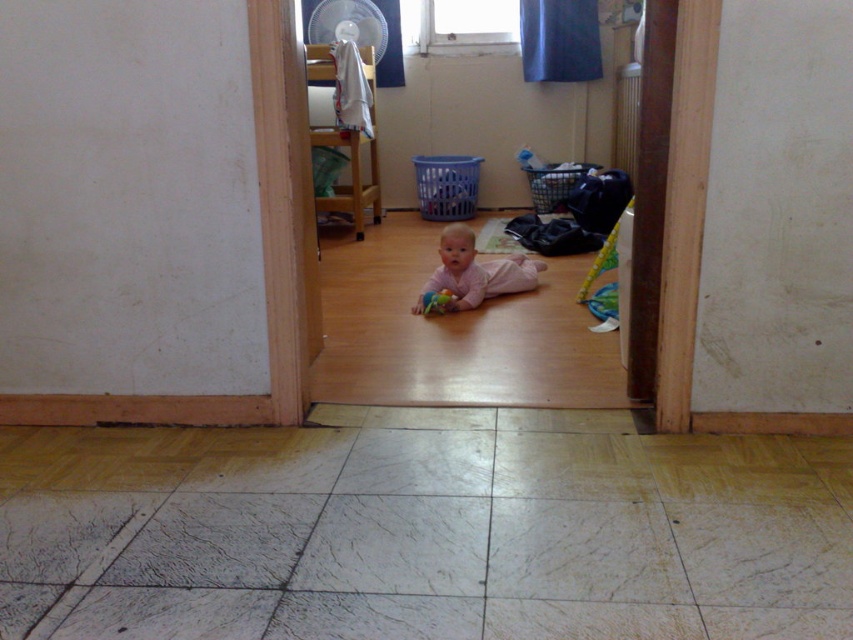
Question: Which object is the farthest from the blue plastic laundry basket at center?

Choices:
 (A) rubberized plastic toy at center
 (B) pink fabric baby at center
 (C) blue plastic laundry basket at center right

Answer: (A)

Question: Can you confirm if white fabric at upper center is wider than blue plastic laundry basket at center right?

Choices:
 (A) no
 (B) yes

Answer: (A)

Question: Is blue plastic laundry basket at center below white fabric at upper center?

Choices:
 (A) no
 (B) yes

Answer: (B)

Question: Which object is positioned farthest from the pink fabric baby at center?

Choices:
 (A) dark blue fabric at upper center
 (B) blue plastic laundry basket at center
 (C) white fabric at upper center

Answer: (A)

Question: In this image, where is blue plastic laundry basket at center right located relative to rubberized plastic toy at center?

Choices:
 (A) above
 (B) below

Answer: (A)

Question: Which point is farther to the camera?

Choices:
 (A) (445, 218)
 (B) (527, 288)
 (C) (585, 74)
 (D) (434, 312)

Answer: (A)